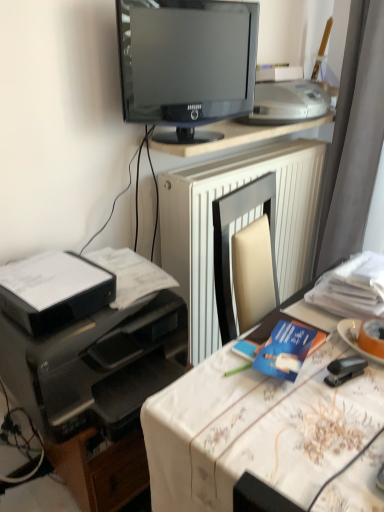
This screenshot has width=384, height=512. What do you see at coordinates (88, 339) in the screenshot?
I see `black plastic printer at left, arranged as the third printer when viewed from the top` at bounding box center [88, 339].

Measure the distance between point (30, 332) and camera.

They are 3.30 feet apart.

What are the coordinates of `white plastic printer at upper right, the 1th printer positioned from the top` in the screenshot? It's located at (287, 102).

Describe the element at coordinates (287, 102) in the screenshot. The height and width of the screenshot is (512, 384). I see `white plastic printer at upper right, the 3th printer ordered from the bottom` at that location.

Find the location of a particular element. The image size is (384, 512). black plastic stapler at lower right is located at coordinates (345, 370).

Where is `black glossy monitor at upper center`? The height and width of the screenshot is (512, 384). black glossy monitor at upper center is located at coordinates (186, 61).

At what (x,y) coordinates should I click in order to perform the action: click on black plastic printer at left, arranged as the third printer when viewed from the top. Please return your answer as a coordinate pair (x, y). This screenshot has height=512, width=384. Looking at the image, I should click on (88, 339).

Are white textured radiator at center and orange matte plate at right far apart?

white textured radiator at center is actually quite close to orange matte plate at right.

Is white textured radiator at center taller than orange matte plate at right?

Correct, white textured radiator at center is much taller as orange matte plate at right.

Between white textured radiator at center and orange matte plate at right, which one has larger width?

white textured radiator at center is wider.

Looking at this image, does white plastic printer at upper right, the 3th printer ordered from the bottom, have a greater height compared to black plastic stapler at lower right?

Yes.

Is white plastic printer at upper right, the 3th printer ordered from the bottom, in front of or behind black plastic stapler at lower right in the image?

In the image, white plastic printer at upper right, the 3th printer ordered from the bottom, appears behind black plastic stapler at lower right.

From the image's perspective, would you say white plastic printer at upper right, the 1th printer positioned from the top, is positioned over black plastic stapler at lower right?

Yes, from the image's perspective, white plastic printer at upper right, the 1th printer positioned from the top, is over black plastic stapler at lower right.

Does white plastic printer at upper right, the 1th printer positioned from the top, have a larger size compared to black plastic stapler at lower right?

Yes, white plastic printer at upper right, the 1th printer positioned from the top, is bigger than black plastic stapler at lower right.

Can we say black plastic stapler at lower right lies outside white plastic printer at upper right, the 1th printer positioned from the top?

black plastic stapler at lower right lies outside white plastic printer at upper right, the 1th printer positioned from the top,'s area.

How different are the orientations of black plastic stapler at lower right and white plastic printer at upper right, the 1th printer positioned from the top, in degrees?

The angle between the facing direction of black plastic stapler at lower right and the facing direction of white plastic printer at upper right, the 1th printer positioned from the top, is 110 degrees.

Which of these two, black plastic stapler at lower right or white plastic printer at upper right, the 1th printer positioned from the top, is smaller?

Smaller between the two is black plastic stapler at lower right.

Does point (345, 372) lie behind point (322, 113)?

No, (345, 372) is closer to viewer.

Is black plastic printer at lower left, acting as the 2th printer starting from the bottom, wider than blue paper at center?

Yes.

From the image's perspective, is black plastic printer at lower left, which is the 2th printer from top to bottom, on blue paper at center?

Yes, from the image's perspective, black plastic printer at lower left, which is the 2th printer from top to bottom, is over blue paper at center.

From the picture: Are black plastic printer at lower left, acting as the 2th printer starting from the bottom, and blue paper at center far apart?

No, black plastic printer at lower left, acting as the 2th printer starting from the bottom, is not far away from blue paper at center.

In terms of height, does black plastic stapler at lower right look taller or shorter compared to white textured radiator at center?

Considering their sizes, black plastic stapler at lower right has less height than white textured radiator at center.

In terms of size, does black plastic stapler at lower right appear bigger or smaller than white textured radiator at center?

In the image, black plastic stapler at lower right appears to be smaller than white textured radiator at center.

Which object is closer to the camera taking this photo, black plastic stapler at lower right or white textured radiator at center?

Positioned in front is black plastic stapler at lower right.

Is point (329, 367) less distant than point (177, 257)?

Yes.

Is black glossy monitor at upper center surrounded by black plastic printer at lower left, acting as the 2th printer starting from the bottom?

No, black glossy monitor at upper center is not a part of black plastic printer at lower left, acting as the 2th printer starting from the bottom.

From a real-world perspective, is black plastic printer at lower left, which is the 2th printer from top to bottom, physically above black glossy monitor at upper center?

No.

Is black plastic printer at lower left, which is the 2th printer from top to bottom, to the left or to the right of black glossy monitor at upper center in the image?

black plastic printer at lower left, which is the 2th printer from top to bottom, is to the left of black glossy monitor at upper center.

Considering the relative sizes of black plastic printer at lower left, which is the 2th printer from top to bottom, and black glossy monitor at upper center in the image provided, is black plastic printer at lower left, which is the 2th printer from top to bottom, bigger than black glossy monitor at upper center?

No.

Consider the image. Is white plastic printer at upper right, the 1th printer positioned from the top, aimed at white textured radiator at center?

No.

In terms of width, does white plastic printer at upper right, the 1th printer positioned from the top, look wider or thinner when compared to white textured radiator at center?

Clearly, white plastic printer at upper right, the 1th printer positioned from the top, has more width compared to white textured radiator at center.

Is point (296, 88) more distant than point (289, 252)?

No, (296, 88) is closer to viewer.

In the image, there is a white plastic printer at upper right, the 1th printer positioned from the top. Identify the location of radiator below it (from the image's perspective). The width and height of the screenshot is (384, 512). (213, 229).

At what (x,y) coordinates should I click in order to perform the action: click on radiator lying behind the orange matte plate at right. Please return your answer as a coordinate pair (x, y). The image size is (384, 512). Looking at the image, I should click on (213, 229).

This screenshot has height=512, width=384. In the image, there is a white plastic printer at upper right, the 3th printer ordered from the bottom. What are the coordinates of `stapler below it (from a real-world perspective)` in the screenshot? It's located at (345, 370).

Considering their positions, is black glossy monitor at upper center positioned further to black plastic printer at left, arranged as the third printer when viewed from the top, than black plastic stapler at lower right?

black glossy monitor at upper center is further to black plastic printer at left, arranged as the third printer when viewed from the top.

When comparing their distances from black plastic printer at left, arranged as the third printer when viewed from the top, does black glossy monitor at upper center or orange matte plate at right seem further?

The object further to black plastic printer at left, arranged as the third printer when viewed from the top, is black glossy monitor at upper center.

Based on the photo, which object lies nearer to the anchor point orange matte plate at right, black plastic stapler at lower right or white plastic printer at upper right, the 1th printer positioned from the top?

The object closer to orange matte plate at right is black plastic stapler at lower right.

Looking at the image, which one is located further to black glossy monitor at upper center, black plastic stapler at lower right or white textured radiator at center?

black plastic stapler at lower right is further to black glossy monitor at upper center.

From the image, which object appears to be nearer to black plastic printer at lower left, acting as the 2th printer starting from the bottom, white textured radiator at center or blue paper at center?

blue paper at center is closer to black plastic printer at lower left, acting as the 2th printer starting from the bottom.

Estimate the real-world distances between objects in this image. Which object is closer to orange matte plate at right, white textured radiator at center or black plastic printer at left, arranged as the third printer when viewed from the top?

black plastic printer at left, arranged as the third printer when viewed from the top, is positioned closer to the anchor orange matte plate at right.

Based on their spatial positions, is orange matte plate at right or black plastic printer at lower left, which is the 2th printer from top to bottom, closer to blue paper at center?

orange matte plate at right.

When comparing their distances from white plastic printer at upper right, the 3th printer ordered from the bottom, does white textured radiator at center or orange matte plate at right seem further?

orange matte plate at right is further to white plastic printer at upper right, the 3th printer ordered from the bottom.

In order to click on radiator between black glossy monitor at upper center and orange matte plate at right in the up-down direction in this screenshot , I will do `click(213, 229)`.

Image resolution: width=384 pixels, height=512 pixels. What are the coordinates of `printer between black glossy monitor at upper center and orange matte plate at right vertically` in the screenshot? It's located at (54, 291).

The height and width of the screenshot is (512, 384). I want to click on printer between black glossy monitor at upper center and black plastic printer at left, the 1th printer in the bottom-to-top sequence, in the vertical direction, so click(54, 291).

Locate an element on the screen. The image size is (384, 512). printer between black glossy monitor at upper center and blue paper at center from top to bottom is located at coordinates (54, 291).